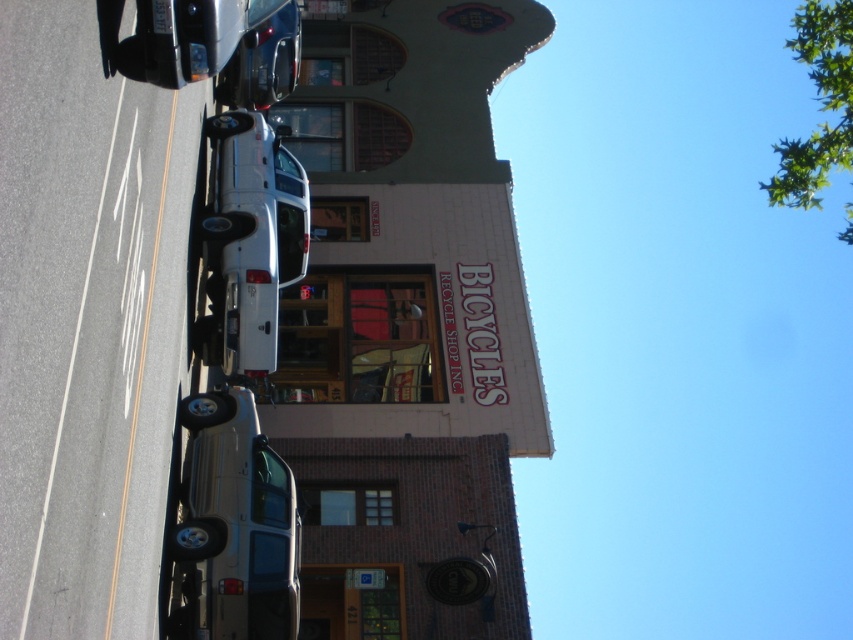
You are standing at the entrance of the BICYCLES RECYCLE SHOP INC. and want to walk to the point marked by point (206, 602). Which direction should you go relative to point (258, 70)?

You should walk towards the direction of point (206, 602), which is in front of point (258, 70).

You are a delivery person who needs to park your 12m long truck. You see the satin silver suv at lower left and the white matte truck at center. Is there enough space between them to park your truck?

The satin silver suv at lower left is 10.92 meters away from the white matte truck at center. Since your truck is 12m long, there isn

You are a delivery person needing to park your 2.5 meter wide vehicle. You see the white matte truck at center and the metallic silver car at upper center parked on the street. Can your vehicle fit between them if you park in the space between?

The metallic silver car at upper center is behind the white matte truck at center, so there is no space between them for your vehicle to park. You need to look for another parking spot.